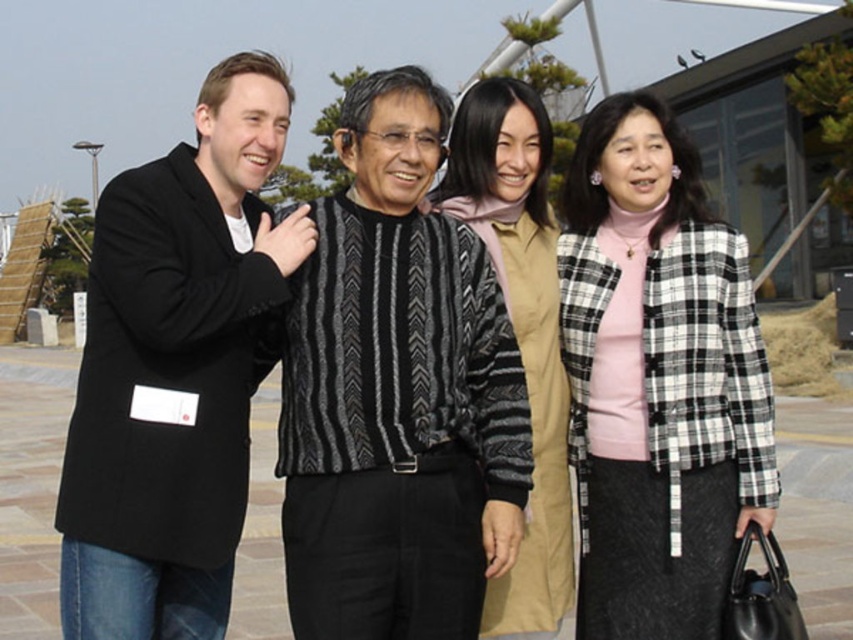
Who is taller, black textured sweater at center or beige textured cardigan at center?

beige textured cardigan at center

Between black textured sweater at center and beige textured cardigan at center, which one appears on the left side from the viewer's perspective?

A: From the viewer's perspective, black textured sweater at center appears more on the left side.

Locate an element on the screen. black textured sweater at center is located at coordinates (397, 394).

Locate an element on the screen. This screenshot has width=853, height=640. black textured sweater at center is located at coordinates (397, 394).

Who is positioned more to the right, black textured sweater at center or checkered wool jacket at right?

Positioned to the right is checkered wool jacket at right.

The height and width of the screenshot is (640, 853). Describe the element at coordinates (397, 394) in the screenshot. I see `black textured sweater at center` at that location.

Find the location of `black textured sweater at center`. black textured sweater at center is located at coordinates tap(397, 394).

Can you confirm if checkered wool jacket at right is shorter than beige textured cardigan at center?

In fact, checkered wool jacket at right may be taller than beige textured cardigan at center.

Is checkered wool jacket at right smaller than beige textured cardigan at center?

Incorrect, checkered wool jacket at right is not smaller in size than beige textured cardigan at center.

Is point (587, 563) closer to camera compared to point (520, 184)?

Yes.

Identify the location of checkered wool jacket at right. (657, 380).